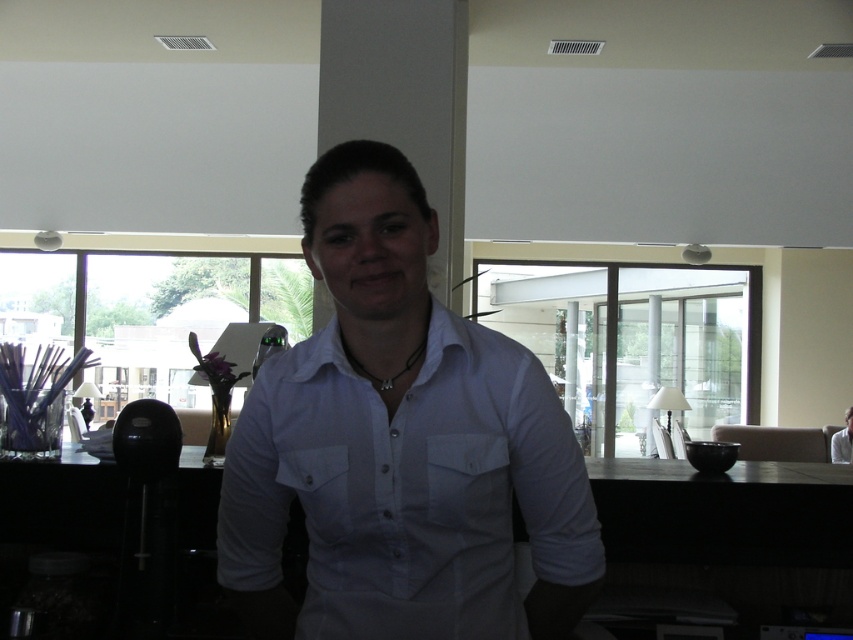
Question: Can you confirm if white cotton shirt at center is wider than white shirt at center?

Choices:
 (A) yes
 (B) no

Answer: (A)

Question: Which point is closer to the camera?

Choices:
 (A) (834, 435)
 (B) (440, 380)

Answer: (B)

Question: Is the position of white cotton shirt at center more distant than that of white shirt at center?

Choices:
 (A) yes
 (B) no

Answer: (B)

Question: Which point appears farthest from the camera in this image?

Choices:
 (A) (839, 440)
 (B) (399, 422)

Answer: (A)

Question: Is white cotton shirt at center bigger than white shirt at center?

Choices:
 (A) no
 (B) yes

Answer: (A)